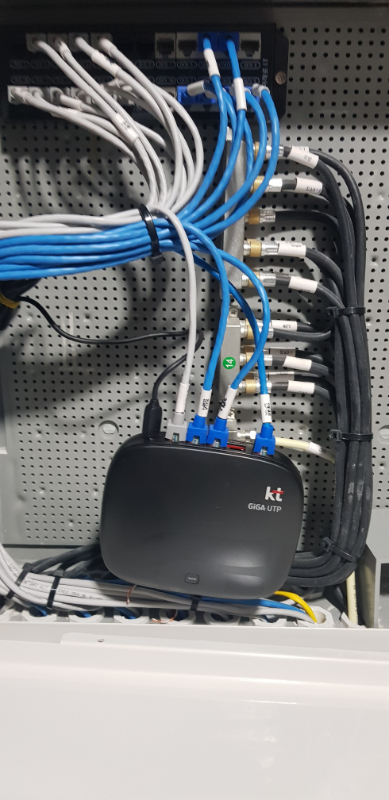
Locate an element on the screen. Image resolution: width=389 pixels, height=800 pixels. black wires in a connection box is located at coordinates (354, 185), (338, 201), (327, 262), (331, 282), (333, 298), (303, 326), (312, 336), (316, 357), (317, 366), (320, 390).